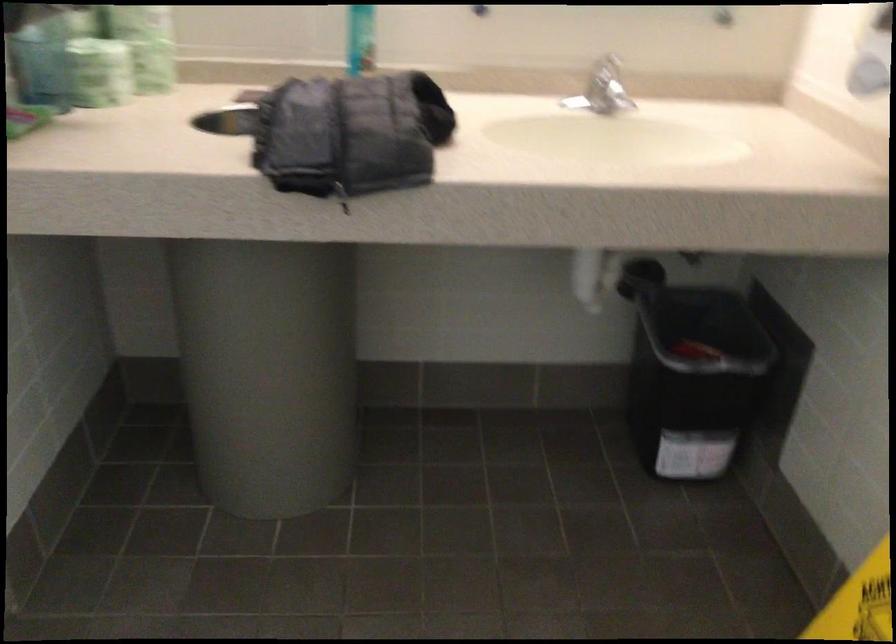
The width and height of the screenshot is (896, 644). What are the coordinates of `pouch zipper pull` in the screenshot? It's located at point(341,196).